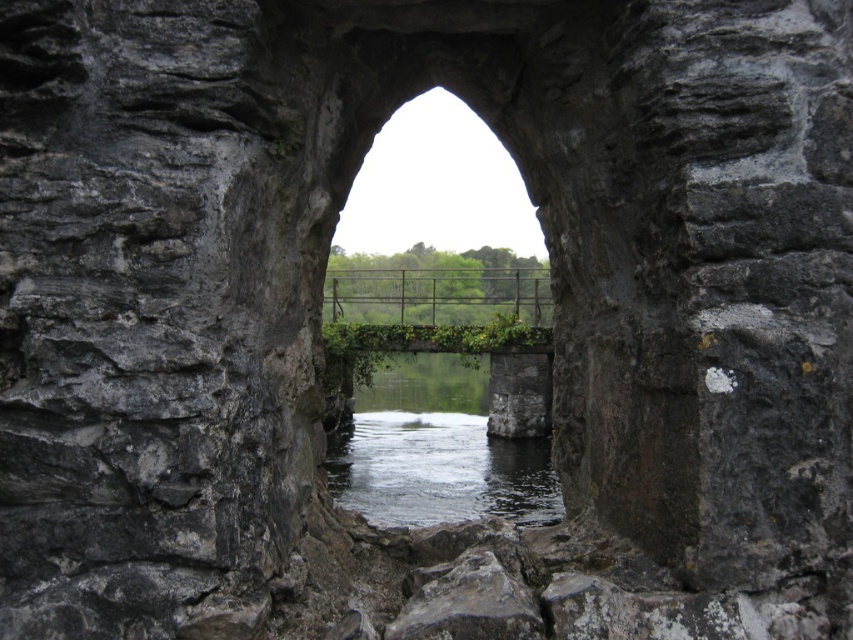
Who is more distant from viewer, [556,481] or [496,301]?

Point [496,301]

This screenshot has height=640, width=853. What do you see at coordinates (439, 449) in the screenshot? I see `clear water at center` at bounding box center [439, 449].

The image size is (853, 640). Describe the element at coordinates (439, 449) in the screenshot. I see `clear water at center` at that location.

Find the location of a particular element. clear water at center is located at coordinates (439, 449).